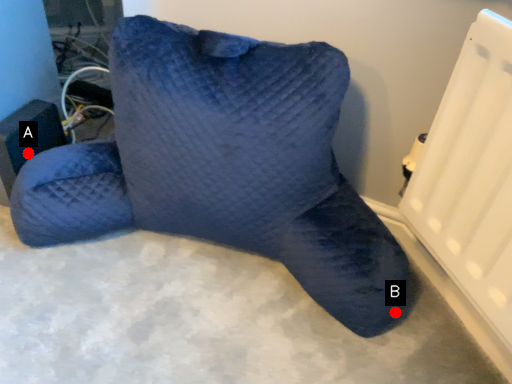
Question: Two points are circled on the image, labeled by A and B beside each circle. Which of the following is the closest to the observer?

Choices:
 (A) A is closer
 (B) B is closer

Answer: (B)